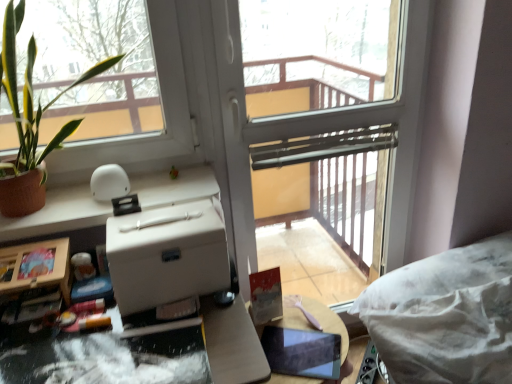
You are a GUI agent. You are given a task and a screenshot of the screen. Output one action in this format:
    pyautogui.click(x=<x>, y=<y>)
    Task: Click on the free spot above wooden round table at center (from a real-world perspective)
    Image resolution: width=512 pixels, height=384 pixels.
    Given the screenshot: What is the action you would take?
    pyautogui.click(x=302, y=334)